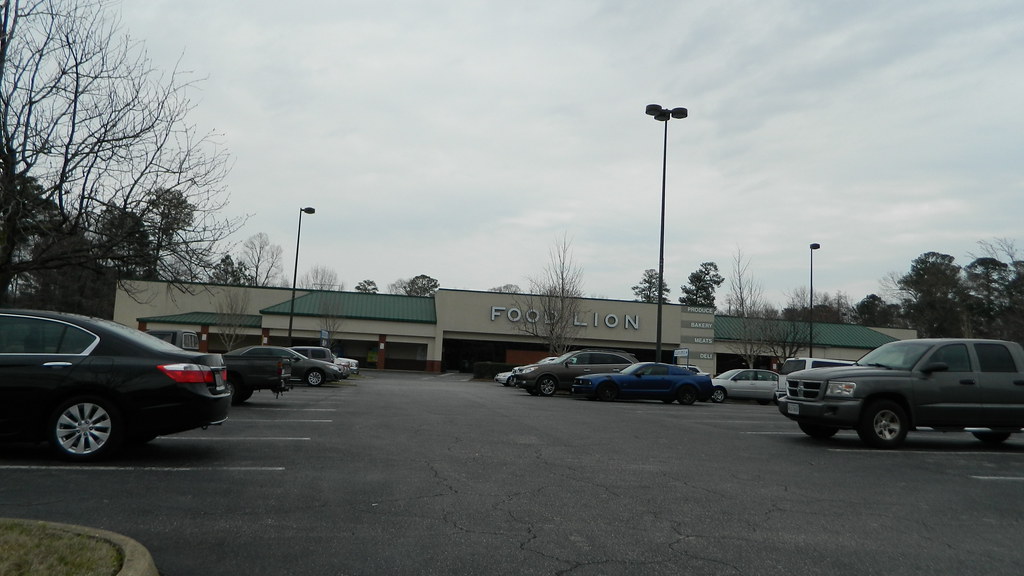
At what (x,y) coordinates should I click in order to perform the action: click on lot lights. Please return your answer as a coordinate pair (x, y). Image resolution: width=1024 pixels, height=576 pixels. Looking at the image, I should click on (304, 218), (667, 119), (807, 245), (682, 107), (656, 107), (313, 212), (826, 238), (810, 255).